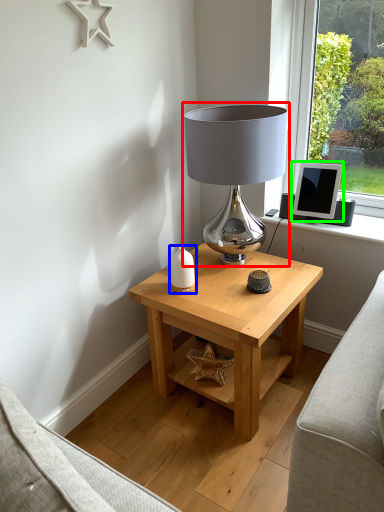
Question: Based on their relative distances, which object is nearer to lamp (highlighted by a red box)? Choose from candle holder (highlighted by a blue box) and computer monitor (highlighted by a green box).

Choices:
 (A) candle holder
 (B) computer monitor

Answer: (A)